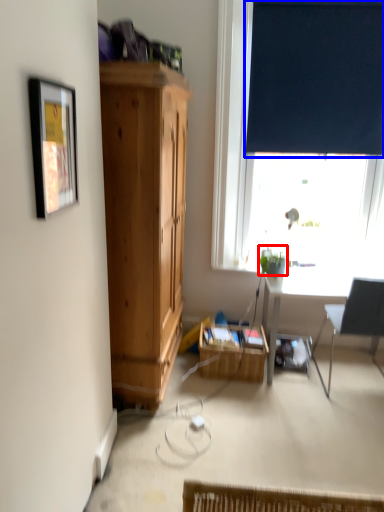
Question: Which of the following is the farthest to the observer, plant (highlighted by a red box) or curtain (highlighted by a blue box)?

Choices:
 (A) plant
 (B) curtain

Answer: (B)